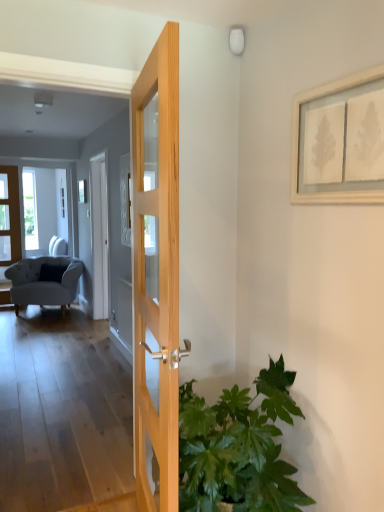
Question: Would you say white wooden picture frame at upper right is to the left or to the right of matte wooden door at left, the first door in the left-to-right sequence, in the picture?

Choices:
 (A) right
 (B) left

Answer: (A)

Question: Considering their positions, is white wooden picture frame at upper right located in front of or behind matte wooden door at left, which is the second door in right-to-left order?

Choices:
 (A) behind
 (B) front

Answer: (B)

Question: Estimate the real-world distances between objects in this image. Which object is farther from the matte wooden door at left, the 1th door when ordered from back to front?

Choices:
 (A) green leafy plant at lower right
 (B) natural wood door at center, arranged as the 2th door when viewed from the left
 (C) white wooden picture frame at upper right
 (D) light gray fabric armchair at left

Answer: (C)

Question: Which object is the farthest from the white wooden picture frame at upper right?

Choices:
 (A) matte wooden door at left, which is the second door in right-to-left order
 (B) light gray fabric armchair at left
 (C) green leafy plant at lower right
 (D) natural wood door at center, acting as the 1th door starting from the front

Answer: (A)